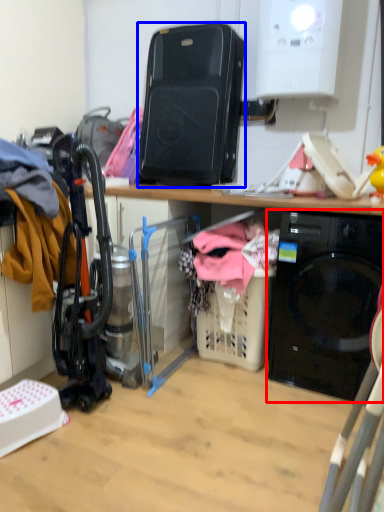
Question: Among these objects, which one is nearest to the camera, home appliance (highlighted by a red box) or appliance (highlighted by a blue box)?

Choices:
 (A) home appliance
 (B) appliance

Answer: (A)